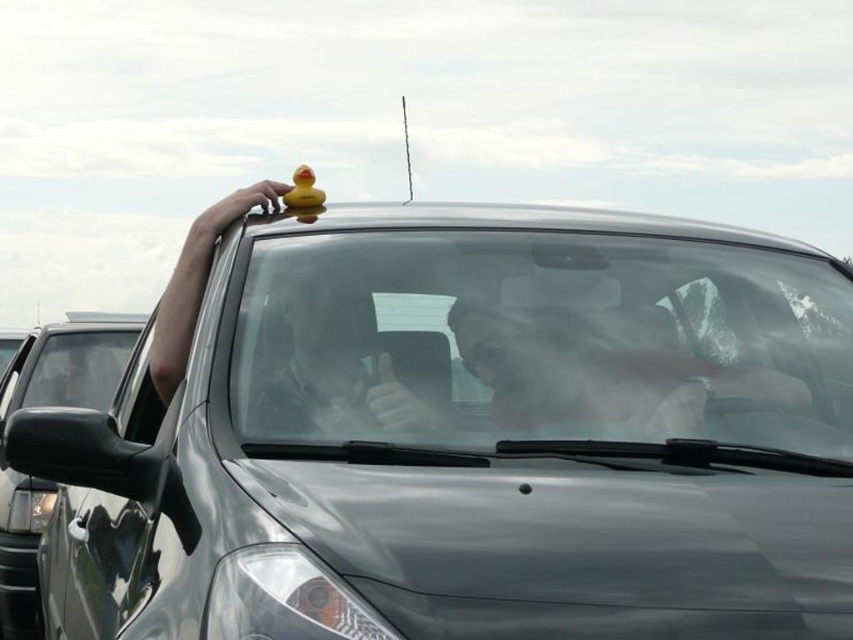
In the scene shown: Measure the distance between clear glass windshield at center and glossy metallic car at left.

11.46 feet

Does clear glass windshield at center have a larger size compared to glossy metallic car at left?

Correct, clear glass windshield at center is larger in size than glossy metallic car at left.

Find the location of a particular element. The height and width of the screenshot is (640, 853). clear glass windshield at center is located at coordinates (540, 340).

You are a GUI agent. You are given a task and a screenshot of the screen. Output one action in this format:
    pyautogui.click(x=<x>, y=<y>)
    Task: Click on the clear glass windshield at center
    The height and width of the screenshot is (640, 853).
    Given the screenshot: What is the action you would take?
    pyautogui.click(x=540, y=340)

Between glossy rubber duck at upper center and rubber duck at center, which one appears on the left side from the viewer's perspective?

From the viewer's perspective, rubber duck at center appears more on the left side.

Does glossy rubber duck at upper center appear under rubber duck at center?

Indeed, glossy rubber duck at upper center is positioned under rubber duck at center.

Who is more distant from viewer, [343,333] or [299,184]?

The point [299,184] is behind.

You are a GUI agent. You are given a task and a screenshot of the screen. Output one action in this format:
    pyautogui.click(x=<x>, y=<y>)
    Task: Click on the glossy rubber duck at upper center
    Image resolution: width=853 pixels, height=640 pixels.
    Given the screenshot: What is the action you would take?
    pyautogui.click(x=469, y=438)

Who is positioned more to the right, glossy rubber duck at upper center or glossy metallic car at left?

From the viewer's perspective, glossy rubber duck at upper center appears more on the right side.

Can you confirm if glossy rubber duck at upper center is positioned to the right of glossy metallic car at left?

A: Correct, you'll find glossy rubber duck at upper center to the right of glossy metallic car at left.

Does point (611, 371) come closer to viewer compared to point (33, 536)?

Yes, point (611, 371) is in front of point (33, 536).

This screenshot has width=853, height=640. I want to click on glossy rubber duck at upper center, so click(x=469, y=438).